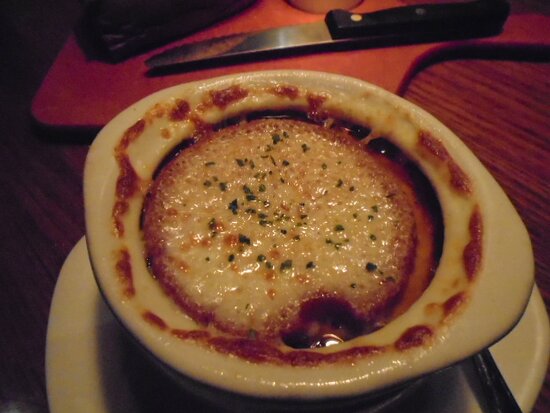
This screenshot has width=550, height=413. I want to click on table, so click(49, 204).